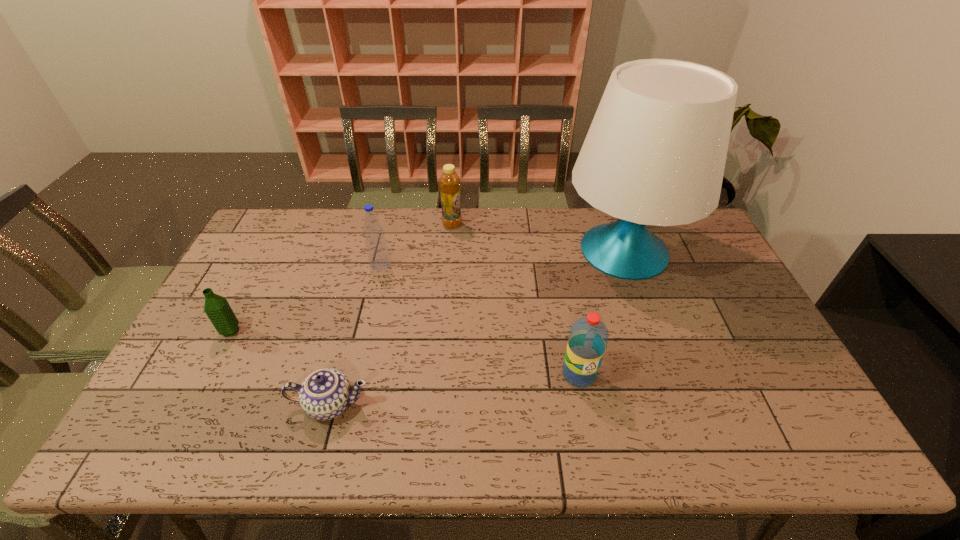
Identify the location of free space at the far edge of the desktop. (349, 241).

Image resolution: width=960 pixels, height=540 pixels. Find the location of `free space at the near edge of the desktop`. free space at the near edge of the desktop is located at coordinates (537, 423).

The image size is (960, 540). In order to click on vacant space at the left edge of the desktop in this screenshot , I will do `click(270, 262)`.

You are a GUI agent. You are given a task and a screenshot of the screen. Output one action in this format:
    pyautogui.click(x=<x>, y=<y>)
    Task: Click on the free space at the right edge of the desktop
    This screenshot has width=960, height=540.
    Given the screenshot: What is the action you would take?
    pyautogui.click(x=755, y=336)

Where is `free space between the fifth tallest object and the table lamp`? This screenshot has width=960, height=540. free space between the fifth tallest object and the table lamp is located at coordinates (427, 291).

You are a GUI agent. You are given a task and a screenshot of the screen. Output one action in this format:
    pyautogui.click(x=<x>, y=<y>)
    Task: Click on the free space between the shortest object and the second farthest water bottle
    Image resolution: width=960 pixels, height=540 pixels.
    Given the screenshot: What is the action you would take?
    pyautogui.click(x=280, y=368)

The image size is (960, 540). What are the coordinates of `free space between the shortest object and the farthest water bottle` in the screenshot? It's located at (355, 334).

Locate an element on the screen. Image resolution: width=960 pixels, height=540 pixels. free space between the third object from right to left and the chinaware is located at coordinates (392, 314).

What are the coordinates of `vacant point located between the third nearest object and the table lamp` in the screenshot? It's located at (427, 291).

You are a GUI agent. You are given a task and a screenshot of the screen. Output one action in this format:
    pyautogui.click(x=<x>, y=<y>)
    Task: Click on the free space between the chinaware and the third object from right to left
    The image size is (960, 540).
    Given the screenshot: What is the action you would take?
    pyautogui.click(x=392, y=314)